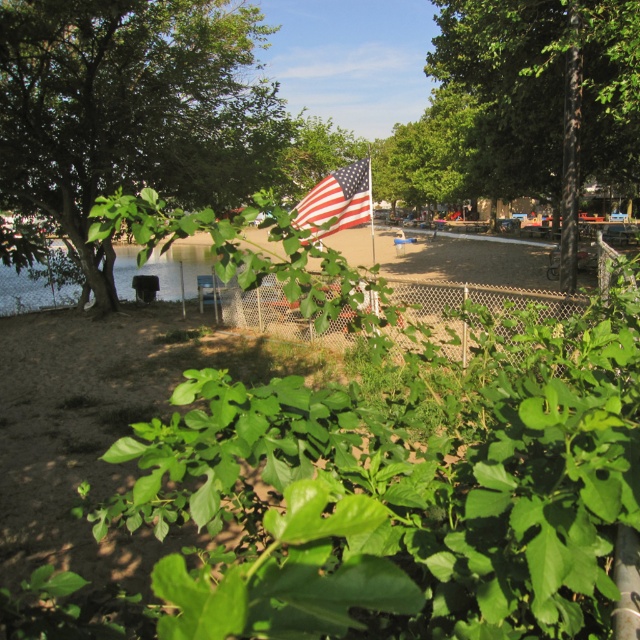
Question: Does green leafy tree at left appear under metallic chain-link fence at center?

Choices:
 (A) no
 (B) yes

Answer: (A)

Question: In this image, where is green leafy tree at center located relative to american flag at center?

Choices:
 (A) below
 (B) above

Answer: (B)

Question: Which of the following is the closest to the observer?

Choices:
 (A) pos(308,189)
 (B) pos(426,294)
 (C) pos(518,17)

Answer: (C)

Question: Based on their relative distances, which object is farther from the american flag at center?

Choices:
 (A) metallic chain-link fence at center
 (B) green leafy tree at left

Answer: (B)

Question: Is metallic chain-link fence at center smaller than clear water at lower left?

Choices:
 (A) yes
 (B) no

Answer: (A)

Question: Which object is positioned closest to the metallic chain-link fence at center?

Choices:
 (A) green leafy tree at left
 (B) clear water at lower left
 (C) american flag at center

Answer: (C)